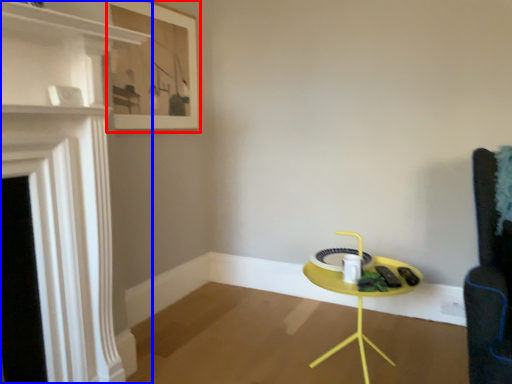
Question: Which point is further to the camera, picture frame (highlighted by a red box) or fireplace (highlighted by a blue box)?

Choices:
 (A) picture frame
 (B) fireplace

Answer: (A)